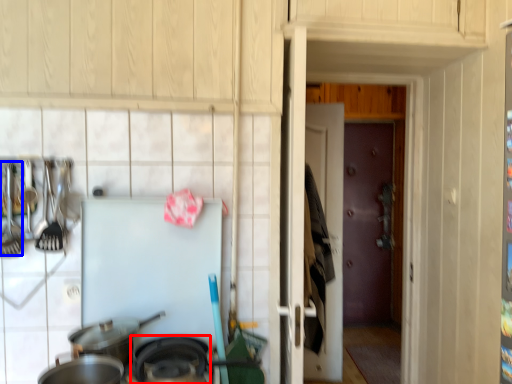
Question: Among these objects, which one is nearest to the camera, wok (highlighted by a red box) or silverware (highlighted by a blue box)?

Choices:
 (A) wok
 (B) silverware

Answer: (A)